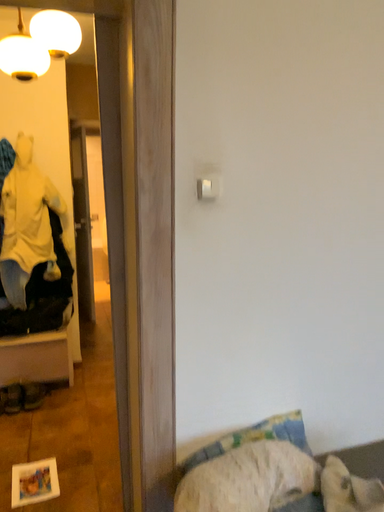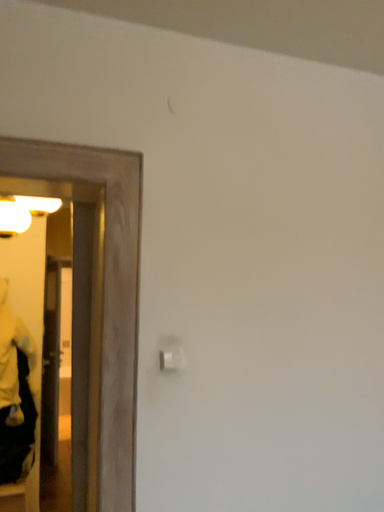
Question: Which way did the camera rotate in the video?

Choices:
 (A) rotated upward
 (B) rotated downward

Answer: (A)